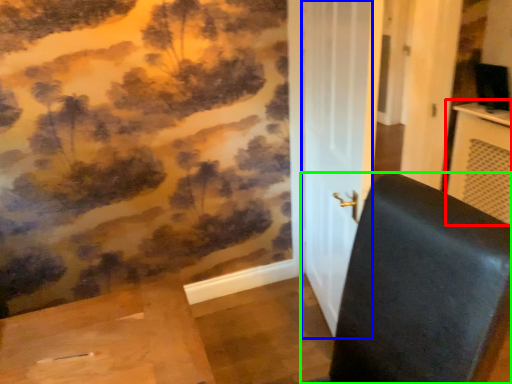
Question: Which object is positioned closest to table (highlighted by a red box)? Select from screen door (highlighted by a blue box) and furniture (highlighted by a green box).

Choices:
 (A) screen door
 (B) furniture

Answer: (A)